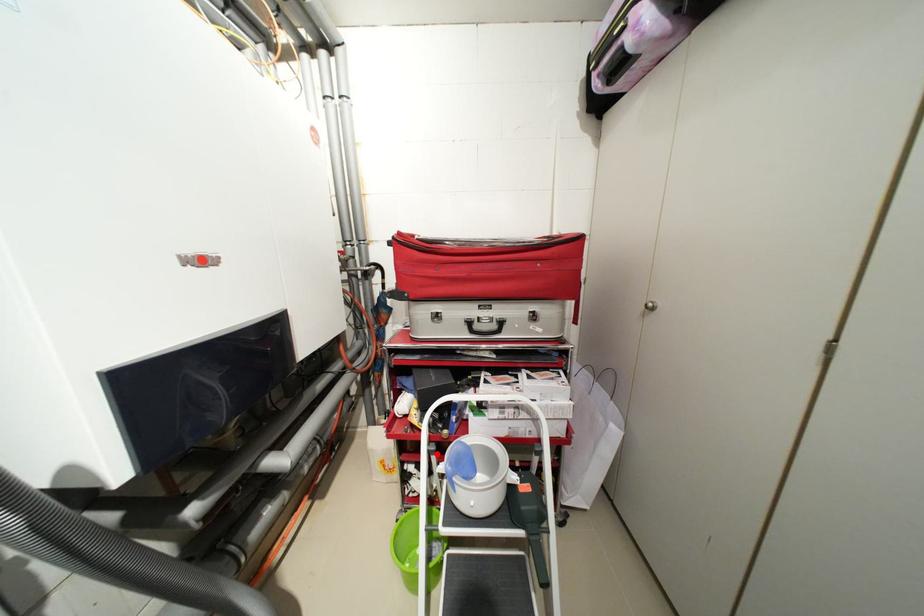
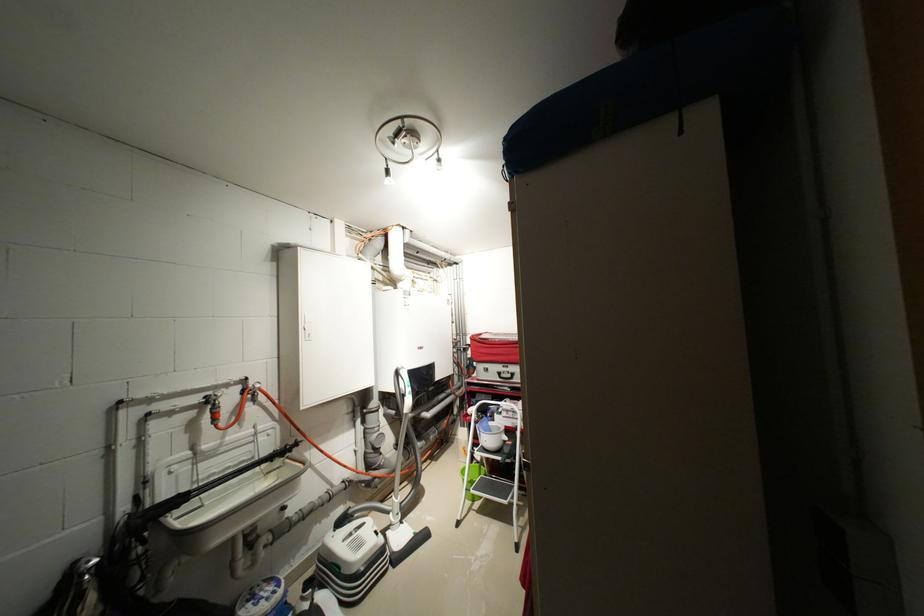
The point at the highlighted location is marked in the first image. Where is the corresponding point in the second image?

(482, 424)